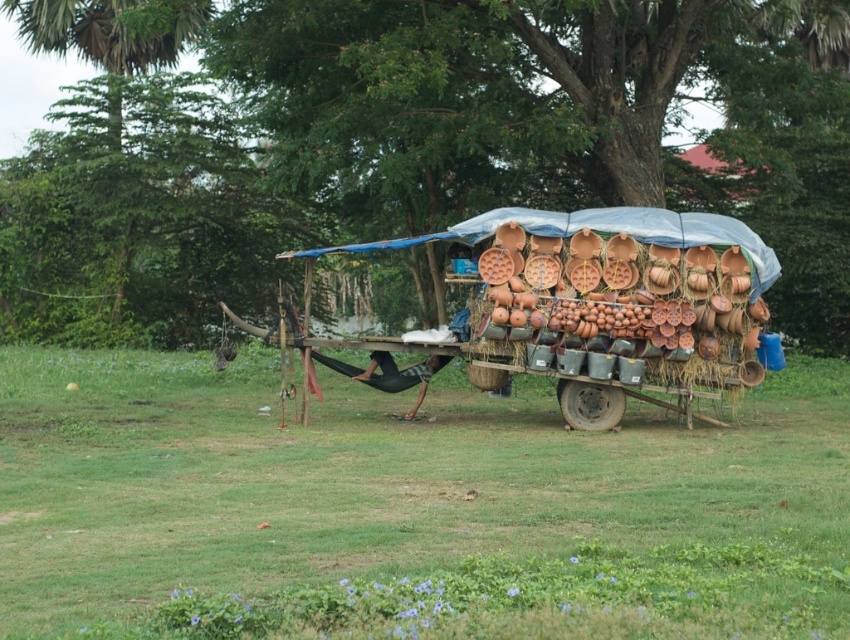
Question: Is green grass at lower center positioned before terracotta clay cart at center?

Choices:
 (A) yes
 (B) no

Answer: (A)

Question: Can you confirm if green grass at lower center is smaller than terracotta clay cart at center?

Choices:
 (A) no
 (B) yes

Answer: (A)

Question: Which point appears closest to the camera in this image?

Choices:
 (A) (499, 467)
 (B) (609, 240)

Answer: (A)

Question: Which point appears farthest from the camera in this image?

Choices:
 (A) (524, 248)
 (B) (446, 433)

Answer: (A)

Question: Can you confirm if green grass at lower center is positioned below terracotta clay cart at center?

Choices:
 (A) no
 (B) yes

Answer: (B)